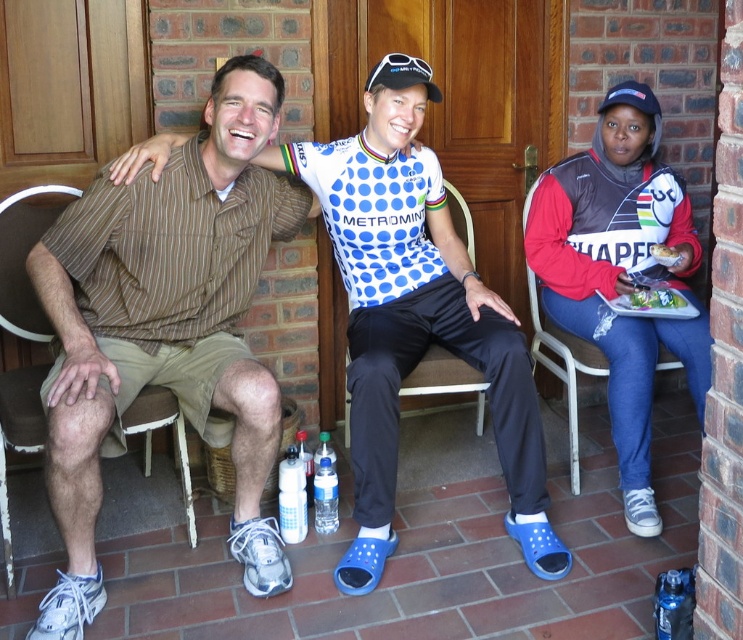
Does point (452, 372) come behind point (655, 253)?

No, it is in front of (655, 253).

Is metallic silver chair at center smaller than white paper plate at center?

Incorrect, metallic silver chair at center is not smaller in size than white paper plate at center.

At what (x,y) coordinates should I click in order to perform the action: click on metallic silver chair at center. Please return your answer as a coordinate pair (x, y). Looking at the image, I should click on (447, 380).

Is metallic silver chair at center bigger than green leafy salad at right?

Indeed, metallic silver chair at center has a larger size compared to green leafy salad at right.

Is metallic silver chair at center to the right of green leafy salad at right from the viewer's perspective?

No, metallic silver chair at center is not to the right of green leafy salad at right.

Locate an element on the screen. Image resolution: width=743 pixels, height=640 pixels. metallic silver chair at center is located at coordinates (447, 380).

I want to click on metallic silver chair at center, so click(447, 380).

Does brown striped shirt at left come behind metallic silver chair at center?

That is False.

Who is positioned more to the left, brown striped shirt at left or metallic silver chair at center?

brown striped shirt at left

Is point (249, 148) positioned in front of point (409, 376)?

That is True.

The width and height of the screenshot is (743, 640). What are the coordinates of `brown striped shirt at left` in the screenshot? It's located at (166, 326).